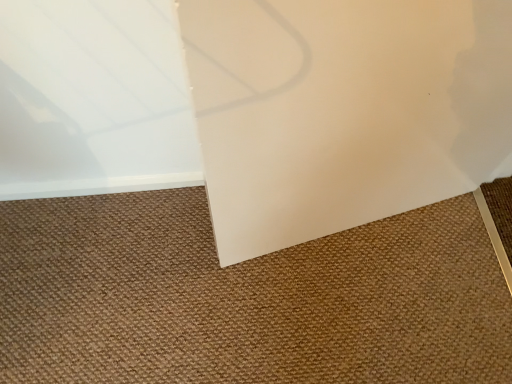
I want to click on white matte doormat at lower center, so click(246, 298).

The height and width of the screenshot is (384, 512). Describe the element at coordinates (246, 298) in the screenshot. I see `white matte doormat at lower center` at that location.

Locate an element on the screen. white matte doormat at lower center is located at coordinates (246, 298).